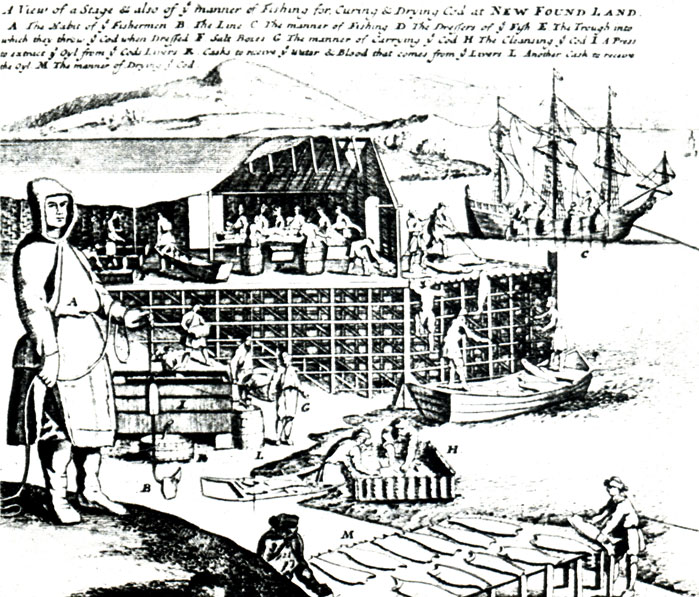
Image resolution: width=699 pixels, height=597 pixels. In order to click on table in this screenshot , I will do `click(509, 536)`.